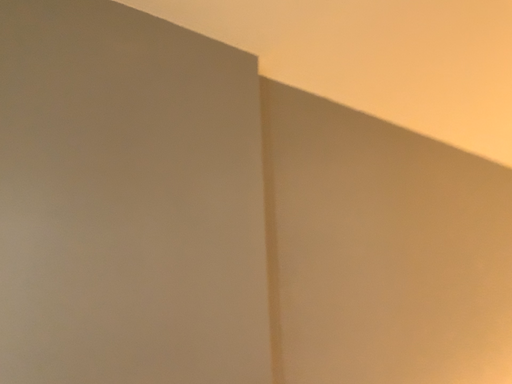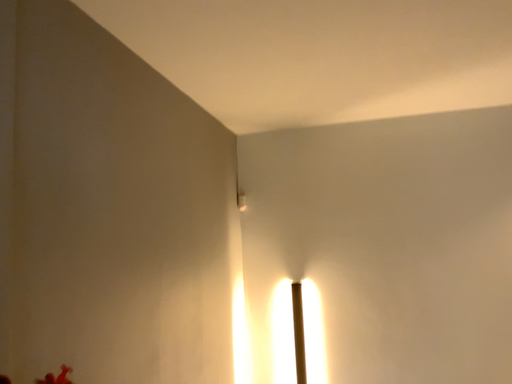
Question: How did the camera likely rotate when shooting the video?

Choices:
 (A) rotated left
 (B) rotated right

Answer: (B)